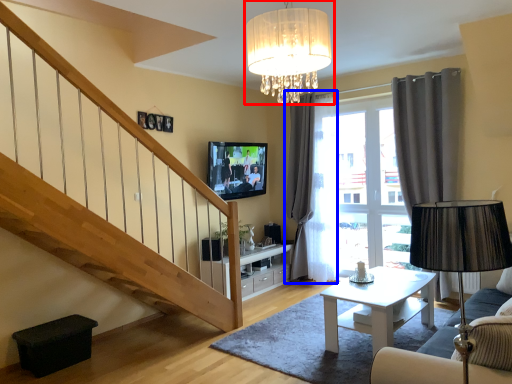
Question: Which object appears farthest to the camera in this image, lamp (highlighted by a red box) or curtain (highlighted by a blue box)?

Choices:
 (A) lamp
 (B) curtain

Answer: (B)